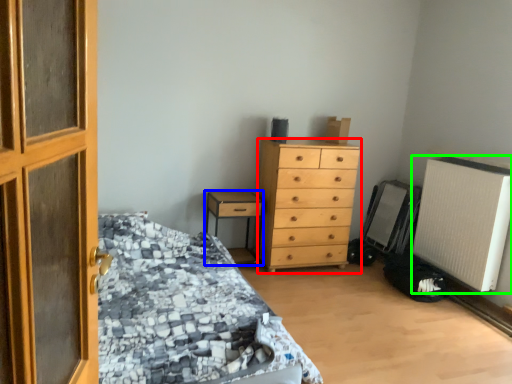
Question: Which object is the closest to the chest of drawers (highlighted by a red box)? Choose among these: nightstand (highlighted by a blue box) or air conditioning (highlighted by a green box).

Choices:
 (A) nightstand
 (B) air conditioning

Answer: (A)